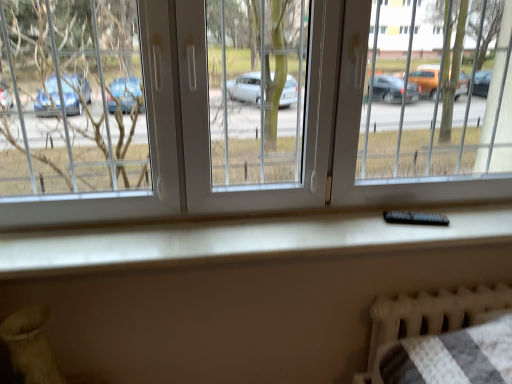
Question: Would you consider black plastic remote at center to be distant from white textured radiator at lower right?

Choices:
 (A) yes
 (B) no

Answer: (B)

Question: Can you confirm if black plastic remote at center is bigger than white textured radiator at lower right?

Choices:
 (A) no
 (B) yes

Answer: (A)

Question: From the image's perspective, does black plastic remote at center appear higher than white textured radiator at lower right?

Choices:
 (A) no
 (B) yes

Answer: (B)

Question: Are black plastic remote at center and white textured radiator at lower right making contact?

Choices:
 (A) yes
 (B) no

Answer: (B)

Question: Does black plastic remote at center have a lesser width compared to white textured radiator at lower right?

Choices:
 (A) yes
 (B) no

Answer: (A)

Question: Considering the relative sizes of black plastic remote at center and white textured radiator at lower right in the image provided, is black plastic remote at center smaller than white textured radiator at lower right?

Choices:
 (A) yes
 (B) no

Answer: (A)

Question: Is black plastic remote at center next to transparent plastic window at center and touching it?

Choices:
 (A) yes
 (B) no

Answer: (B)

Question: Does black plastic remote at center appear on the left side of transparent plastic window at center?

Choices:
 (A) yes
 (B) no

Answer: (B)

Question: Is transparent plastic window at center surrounded by black plastic remote at center?

Choices:
 (A) no
 (B) yes

Answer: (A)

Question: Considering the relative sizes of black plastic remote at center and transparent plastic window at center in the image provided, is black plastic remote at center smaller than transparent plastic window at center?

Choices:
 (A) no
 (B) yes

Answer: (B)

Question: Is black plastic remote at center positioned far away from transparent plastic window at center?

Choices:
 (A) yes
 (B) no

Answer: (B)

Question: Can you confirm if black plastic remote at center is positioned to the right of transparent plastic window at center?

Choices:
 (A) yes
 (B) no

Answer: (A)

Question: Is transparent plastic window at center positioned beyond the bounds of black plastic remote at center?

Choices:
 (A) yes
 (B) no

Answer: (A)